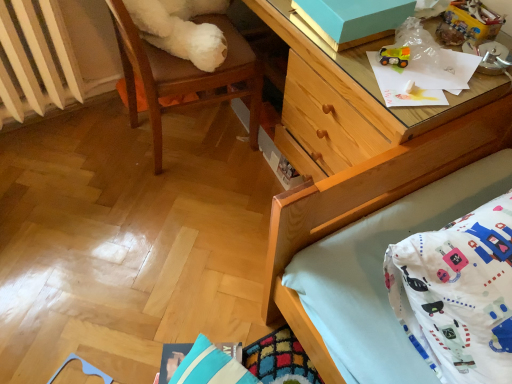
The image size is (512, 384). Identify the location of spots to the right of rubberized yellow toy truck at upper right, the first toy positioned from the left. (457, 71).